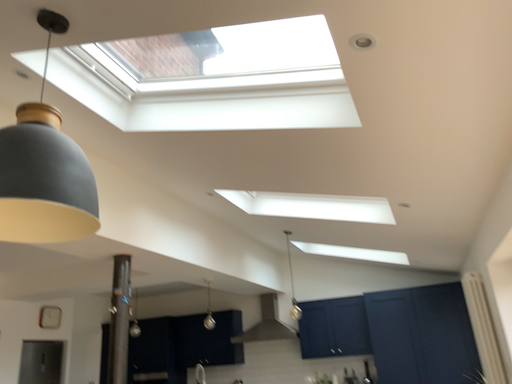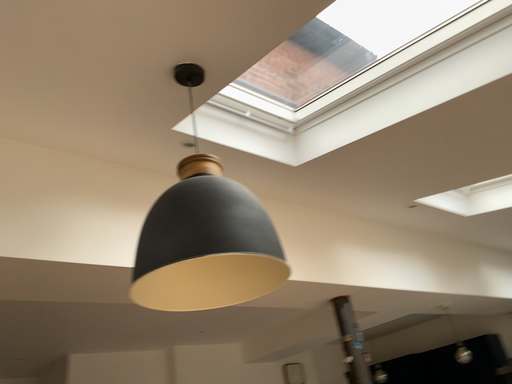
Question: How did the camera likely rotate when shooting the video?

Choices:
 (A) rotated left
 (B) rotated right

Answer: (A)